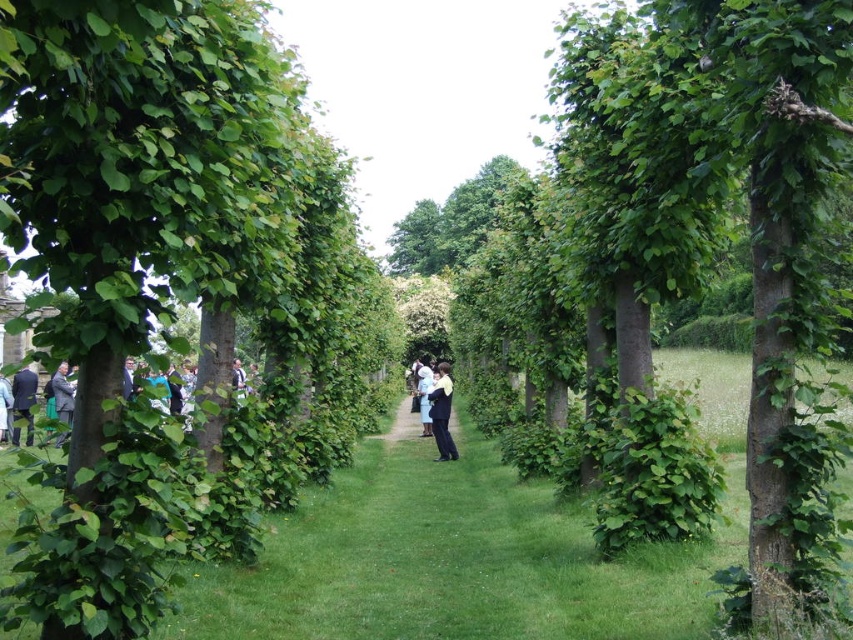
Does green grass at center have a larger size compared to matte black suit at left?

Yes, green grass at center is bigger than matte black suit at left.

Can you confirm if green grass at center is thinner than matte black suit at left?

No.

Locate an element on the screen. Image resolution: width=853 pixels, height=640 pixels. green grass at center is located at coordinates (453, 557).

Locate an element on the screen. The image size is (853, 640). green grass at center is located at coordinates (453, 557).

Is dark gray suit at left positioned before light blue fabric at center?

Yes, dark gray suit at left is in front of light blue fabric at center.

Which is above, dark gray suit at left or light blue fabric at center?

dark gray suit at left is above.

I want to click on dark gray suit at left, so click(62, 397).

Is green leafy tree at center behind black smooth suit at center?

No, green leafy tree at center is in front of black smooth suit at center.

Can you confirm if green leafy tree at center is positioned to the right of black smooth suit at center?

No, green leafy tree at center is not to the right of black smooth suit at center.

Which is behind, point (113, 54) or point (444, 426)?

The point (444, 426) is more distant.

Find the location of a particular element. Image resolution: width=853 pixels, height=640 pixels. green leafy tree at center is located at coordinates (170, 289).